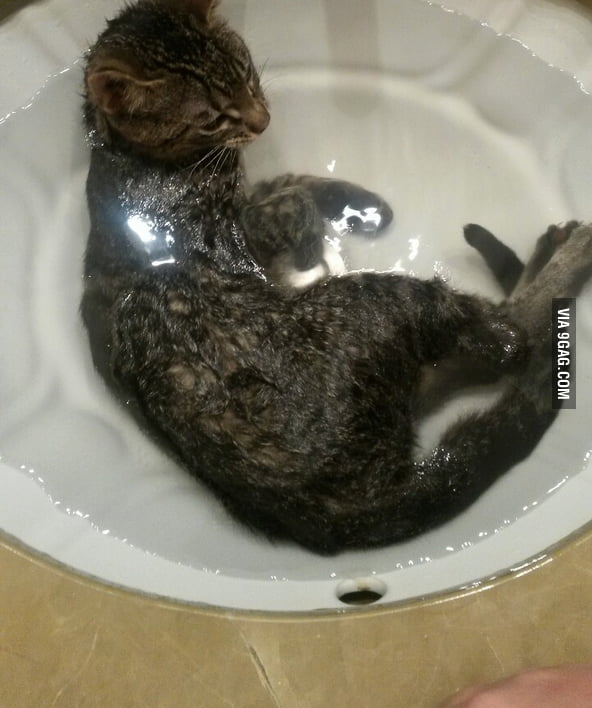
The width and height of the screenshot is (592, 708). I want to click on sink, so click(x=210, y=592).